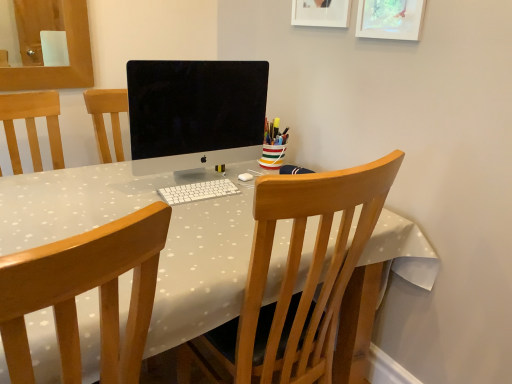
In order to click on free point above white plastic keyboard at center (from a real-world perspective) in this screenshot , I will do `click(208, 183)`.